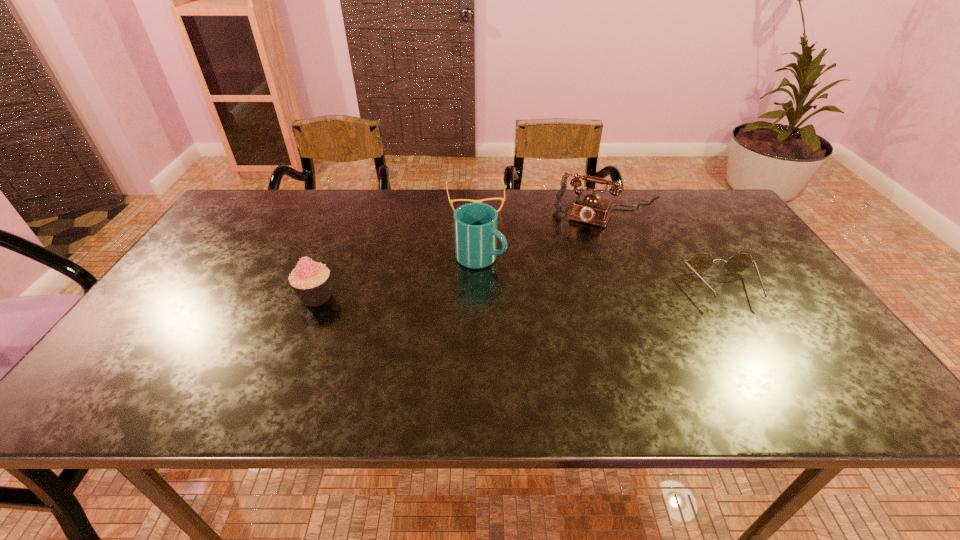
Where is `object situated at the right edge`? The image size is (960, 540). object situated at the right edge is located at coordinates (701, 262).

What are the coordinates of `free space at the far edge` in the screenshot? It's located at (424, 213).

At what (x,y) coordinates should I click in order to perform the action: click on free space at the near edge. Please return your answer as a coordinate pair (x, y). The image size is (960, 540). Looking at the image, I should click on click(704, 344).

Where is `free space at the left edge of the desktop`? free space at the left edge of the desktop is located at coordinates (188, 286).

At what (x,y) coordinates should I click in order to perform the action: click on free space at the right edge. Please return your answer as a coordinate pair (x, y). The image size is (960, 540). Looking at the image, I should click on (809, 339).

Find the location of a particular element. The image size is (960, 540). free space between the telephone and the nearer spectacles is located at coordinates (668, 249).

At what (x,y) coordinates should I click in order to perform the action: click on free space between the telephone and the shortest object. Please return your answer as a coordinate pair (x, y). This screenshot has width=960, height=540. Looking at the image, I should click on (x=543, y=206).

The width and height of the screenshot is (960, 540). In order to click on free space between the right spectacles and the farther spectacles in this screenshot , I will do `click(599, 245)`.

I want to click on vacant area between the farther spectacles and the cupcake, so click(396, 249).

In order to click on free space between the shorter spectacles and the taller spectacles in this screenshot , I will do `click(599, 245)`.